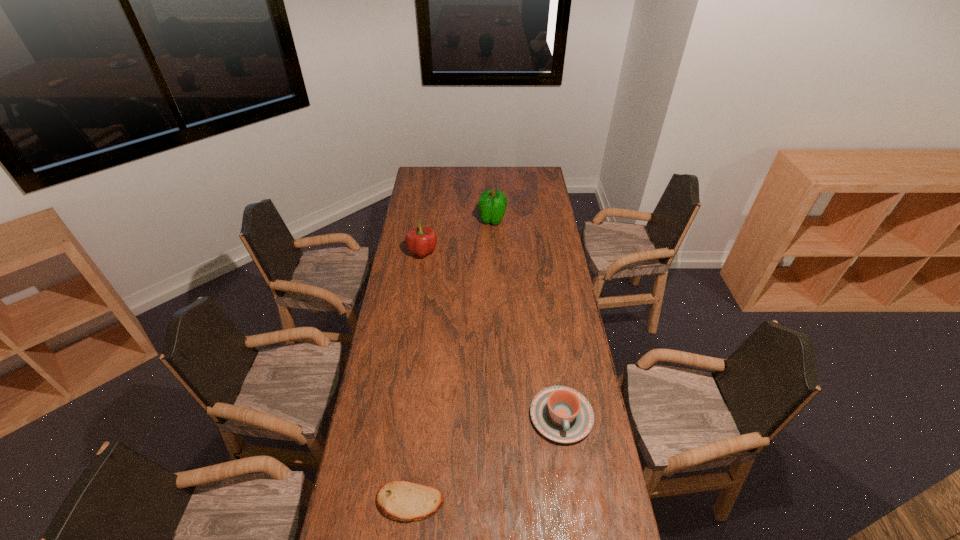
At what (x,y) coordinates should I click in order to perform the action: click on free spot located 0.200m on the handle side of the rightmost object. Please return your answer as a coordinate pair (x, y). Looking at the image, I should click on (575, 511).

The image size is (960, 540). What are the coordinates of `vacant space located on the left of the shortest object` in the screenshot? It's located at (348, 502).

Identify the location of bell pepper located at the left edge. (420, 241).

The width and height of the screenshot is (960, 540). I want to click on pita bread located at the left edge, so click(405, 501).

At what (x,y) coordinates should I click in order to perform the action: click on object at the right edge. Please return your answer as a coordinate pair (x, y). The width and height of the screenshot is (960, 540). Looking at the image, I should click on (562, 414).

The height and width of the screenshot is (540, 960). Find the location of `free spot at the far edge of the desktop`. free spot at the far edge of the desktop is located at coordinates (x=517, y=173).

Image resolution: width=960 pixels, height=540 pixels. In order to click on vacant region at the left edge of the desktop in this screenshot , I will do `click(427, 268)`.

Locate an element on the screen. vacant space at the right edge is located at coordinates (540, 317).

Identify the location of free space at the far left corner. tap(424, 172).

In order to click on unoccupied position between the left bell pepper and the third farthest object in this screenshot , I will do `click(492, 334)`.